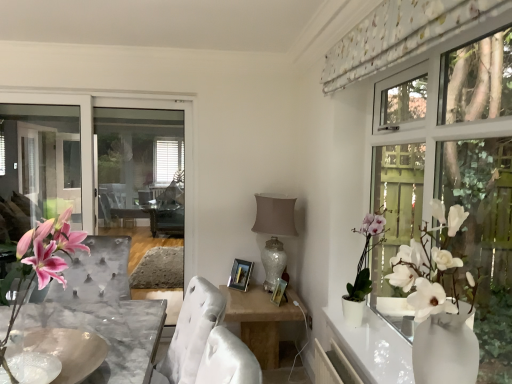
Describe the element at coordinates (274, 232) in the screenshot. I see `white glossy lamp at center` at that location.

Where is `clear glass window screen at left`? The image size is (512, 384). clear glass window screen at left is located at coordinates (94, 138).

The height and width of the screenshot is (384, 512). What do you see at coordinates (400, 35) in the screenshot? I see `white floral fabric at upper right` at bounding box center [400, 35].

Where is `white floral fabric at upper right`? This screenshot has width=512, height=384. white floral fabric at upper right is located at coordinates (400, 35).

The height and width of the screenshot is (384, 512). I want to click on satin beige table at center, so click(x=261, y=320).

Is pink silk flowers at lower left surrounding clear glass window screen at left?

No, clear glass window screen at left is located outside of pink silk flowers at lower left.

From a real-world perspective, is pink silk flowers at lower left on top of clear glass window screen at left?

Yes.

How much distance is there between pink silk flowers at lower left and clear glass window screen at left?

pink silk flowers at lower left and clear glass window screen at left are 2.05 meters apart from each other.

Is pink silk flowers at lower left thinner than clear glass window screen at left?

In fact, pink silk flowers at lower left might be wider than clear glass window screen at left.

Which point is more distant from viewer, (90,343) or (291,213)?

Point (291,213)

In terms of height, does marble bowl at center look taller or shorter compared to white glossy lamp at center?

In the image, marble bowl at center appears to be shorter than white glossy lamp at center.

This screenshot has width=512, height=384. There is a marble bowl at center. Find the location of `lamp above it (from a real-world perspective)`. lamp above it (from a real-world perspective) is located at coordinates (274, 232).

In terms of width, does marble bowl at center look wider or thinner when compared to white glossy lamp at center?

marble bowl at center is wider than white glossy lamp at center.

From a real-world perspective, relative to satin beige table at center, is clear glass window screen at left vertically above or below?

In terms of real-world spatial position, clear glass window screen at left is above satin beige table at center.

Is clear glass window screen at left at the right side of satin beige table at center?

No.

Between clear glass window screen at left and satin beige table at center, which one has smaller size?

clear glass window screen at left is smaller.

Which point is more distant from viewer, (361, 288) or (32, 343)?

The point (361, 288) is behind.

From the image's perspective, which is below, white ceramic plant at upper right or marble bowl at center?

marble bowl at center.

Is white ceramic plant at upper right positioned in front of marble bowl at center?

No, it is not.

Which object is positioned more to the right, white ceramic plant at upper right or marble bowl at center?

Positioned to the right is white ceramic plant at upper right.

Which object is further away from the camera taking this photo, satin beige table at center or white ceramic plant at upper right?

satin beige table at center is further from the camera.

Are satin beige table at center and white ceramic plant at upper right located far from each other?

No, satin beige table at center is not far from white ceramic plant at upper right.

Considering the positions of objects satin beige table at center and white ceramic plant at upper right in the image provided, who is more to the right, satin beige table at center or white ceramic plant at upper right?

white ceramic plant at upper right is more to the right.

Is satin beige table at center bigger than white ceramic plant at upper right?

Yes, satin beige table at center is bigger than white ceramic plant at upper right.

Which is in front, point (229, 290) or point (267, 283)?

The point (267, 283) is closer.

Is the position of satin beige table at center less distant than that of white glossy lamp at center?

Yes, satin beige table at center is in front of white glossy lamp at center.

The width and height of the screenshot is (512, 384). Find the location of `table located below the white glossy lamp at center (from the image's perspective)`. table located below the white glossy lamp at center (from the image's perspective) is located at coordinates (261, 320).

From the image's perspective, which one is positioned lower, satin beige table at center or white glossy lamp at center?

From the image's view, satin beige table at center is below.

Considering the relative positions of clear glass window screen at left and white ceramic plant at upper right in the image provided, is clear glass window screen at left to the left or to the right of white ceramic plant at upper right?

From the image, it's evident that clear glass window screen at left is to the left of white ceramic plant at upper right.

Considering the sizes of clear glass window screen at left and white ceramic plant at upper right in the image, is clear glass window screen at left bigger or smaller than white ceramic plant at upper right?

clear glass window screen at left is bigger than white ceramic plant at upper right.

Would you say clear glass window screen at left is outside white ceramic plant at upper right?

Indeed, clear glass window screen at left is completely outside white ceramic plant at upper right.

Considering the points (140, 292) and (357, 298), which point is behind, point (140, 292) or point (357, 298)?

Positioned behind is point (140, 292).

Identify the location of window screen on the left of the pink silk flowers at lower left. This screenshot has height=384, width=512. (94, 138).

This screenshot has width=512, height=384. In the image, there is a white glossy lamp at center. In order to click on round table below it (from a real-world perspective) in this screenshot , I will do `click(69, 350)`.

Consider the image. Considering their positions, is clear glass window screen at left positioned further to white ceramic plant at upper right than pink silk flowers at lower left?

clear glass window screen at left lies further to white ceramic plant at upper right than the other object.

Based on their spatial positions, is clear glass window screen at left or white floral fabric at upper right closer to pink silk flowers at lower left?

The object closer to pink silk flowers at lower left is white floral fabric at upper right.

Considering their positions, is pink silk flowers at lower left positioned further to white glossy lamp at center than clear glass window screen at left?

pink silk flowers at lower left lies further to white glossy lamp at center than the other object.

Based on their spatial positions, is white glossy lamp at center or clear glass window screen at left further from white ceramic plant at upper right?

Among the two, clear glass window screen at left is located further to white ceramic plant at upper right.

Looking at the image, which one is located further to clear glass window screen at left, white ceramic plant at upper right or white glossy lamp at center?

white ceramic plant at upper right is further to clear glass window screen at left.

When comparing their distances from white ceramic plant at upper right, does clear glass window screen at left or marble bowl at center seem closer?

marble bowl at center is closer to white ceramic plant at upper right.

Based on their spatial positions, is satin beige table at center or clear glass window screen at left further from white ceramic plant at upper right?

Among the two, clear glass window screen at left is located further to white ceramic plant at upper right.

Estimate the real-world distances between objects in this image. Which object is closer to white floral fabric at upper right, pink silk flowers at lower left or marble bowl at center?

Among the two, pink silk flowers at lower left is located nearer to white floral fabric at upper right.

This screenshot has width=512, height=384. In order to click on lamp between white floral fabric at upper right and clear glass window screen at left from front to back in this screenshot , I will do `click(274, 232)`.

Where is `table situated between clear glass window screen at left and white glossy lamp at center from left to right`? The width and height of the screenshot is (512, 384). table situated between clear glass window screen at left and white glossy lamp at center from left to right is located at coordinates (261, 320).

Identify the location of curtain located between pink silk flowers at lower left and white ceramic plant at upper right in the left-right direction. (400, 35).

Image resolution: width=512 pixels, height=384 pixels. Find the location of `table between pink silk flowers at lower left and white glossy lamp at center along the z-axis`. table between pink silk flowers at lower left and white glossy lamp at center along the z-axis is located at coordinates (261, 320).